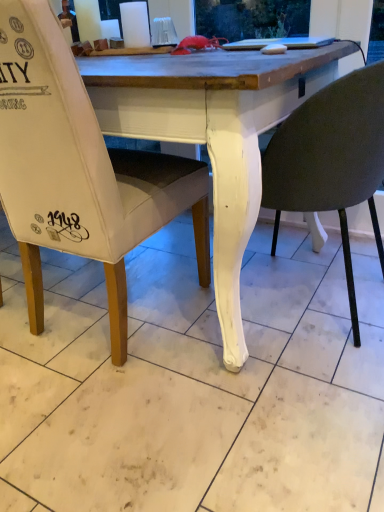
Question: Is white fabric chair at left, arranged as the second chair when viewed from the right, bigger or smaller than white matte chair at lower center, marked as the 1th chair in a right-to-left arrangement?

Choices:
 (A) small
 (B) big

Answer: (B)

Question: Considering the positions of point (137, 205) and point (339, 170), is point (137, 205) closer or farther from the camera than point (339, 170)?

Choices:
 (A) closer
 (B) farther

Answer: (B)

Question: In the image, is white fabric chair at left, arranged as the second chair when viewed from the right, positioned in front of or behind white matte chair at lower center, which appears as the 2th chair when viewed from the left?

Choices:
 (A) behind
 (B) front

Answer: (B)

Question: Is white matte chair at lower center, marked as the 1th chair in a right-to-left arrangement, taller or shorter than white fabric chair at left, arranged as the second chair when viewed from the right?

Choices:
 (A) short
 (B) tall

Answer: (A)

Question: From the image's perspective, relative to white fabric chair at left, arranged as the second chair when viewed from the right, is white matte chair at lower center, marked as the 1th chair in a right-to-left arrangement, above or below?

Choices:
 (A) above
 (B) below

Answer: (B)

Question: Looking at the image, does white matte chair at lower center, which appears as the 2th chair when viewed from the left, seem bigger or smaller compared to white fabric chair at left, the first chair positioned from the left?

Choices:
 (A) small
 (B) big

Answer: (A)

Question: In the image, is white matte chair at lower center, which appears as the 2th chair when viewed from the left, on the left side or the right side of white fabric chair at left, the first chair positioned from the left?

Choices:
 (A) right
 (B) left

Answer: (A)